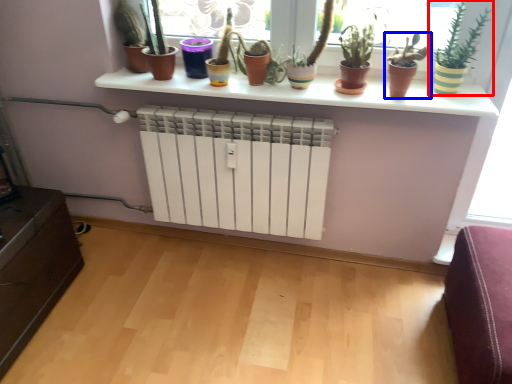
Question: Which point is further to the camera, houseplant (highlighted by a red box) or houseplant (highlighted by a blue box)?

Choices:
 (A) houseplant
 (B) houseplant

Answer: (B)